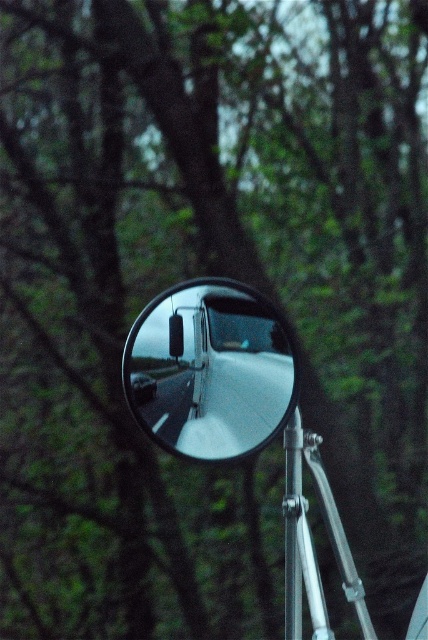
Is clear glass mirror at center to the left of silver metallic pole at center from the viewer's perspective?

Indeed, clear glass mirror at center is positioned on the left side of silver metallic pole at center.

Which is in front, point (158, 349) or point (288, 545)?

Point (158, 349) is in front.

You are a GUI agent. You are given a task and a screenshot of the screen. Output one action in this format:
    pyautogui.click(x=<x>, y=<y>)
    Task: Click on the clear glass mirror at center
    
    Given the screenshot: What is the action you would take?
    pyautogui.click(x=211, y=371)

Find the location of a particular element. clear glass mirror at center is located at coordinates (211, 371).